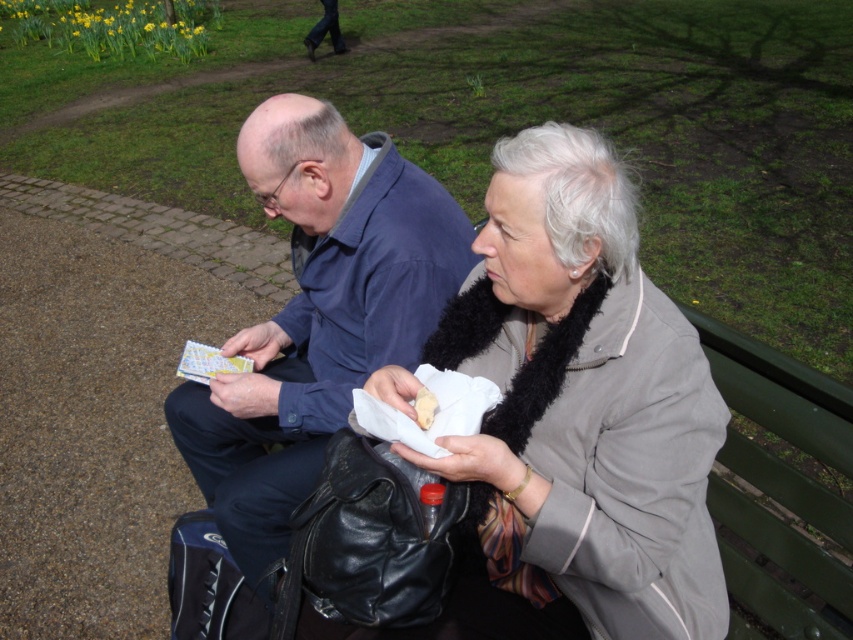
Question: Does light gray fabric jacket at center lie in front of blue fabric jacket at center?

Choices:
 (A) no
 (B) yes

Answer: (B)

Question: Which point appears closest to the camera in this image?

Choices:
 (A) (457, 275)
 (B) (520, 433)
 (C) (422, 397)

Answer: (B)

Question: Does blue fabric jacket at center appear on the left side of white paper napkin at lower center?

Choices:
 (A) no
 (B) yes

Answer: (B)

Question: Does light gray fabric jacket at center have a smaller size compared to blue fabric jacket at center?

Choices:
 (A) no
 (B) yes

Answer: (B)

Question: Considering the real-world distances, which object is closest to the light gray fabric jacket at center?

Choices:
 (A) white paper napkin at lower center
 (B) blue fabric jacket at center

Answer: (A)

Question: Estimate the real-world distances between objects in this image. Which object is closer to the white paper napkin at lower center?

Choices:
 (A) light gray fabric jacket at center
 (B) blue fabric jacket at center

Answer: (A)